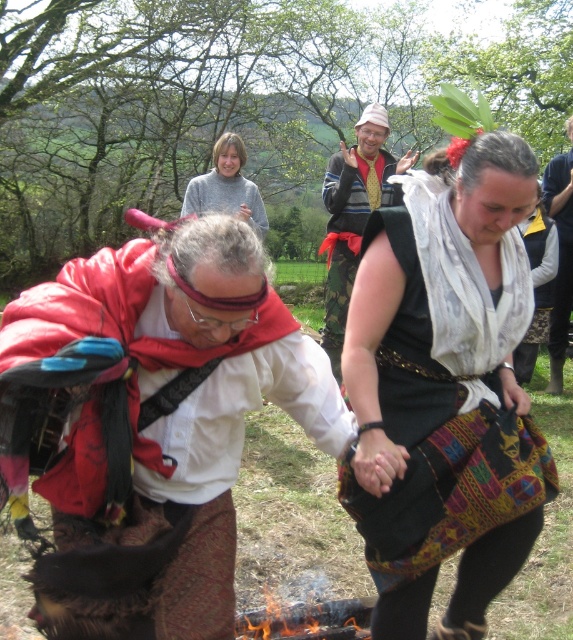
Question: Does striped sweater at center appear over velvet yellow vest at center?

Choices:
 (A) yes
 (B) no

Answer: (B)

Question: Which of the following is the farthest from the observer?

Choices:
 (A) velvet yellow vest at center
 (B) charcoal wood fire at lower center
 (C) light brown hair at upper center

Answer: (A)

Question: Is matte red cape at center wider than black woven fabric bag at center?

Choices:
 (A) yes
 (B) no

Answer: (A)

Question: Among these points, which one is farthest from the camera?

Choices:
 (A) coord(476,493)
 (B) coord(293,372)

Answer: (A)

Question: Among these objects, which one is nearest to the camera?

Choices:
 (A) light brown hair at upper center
 (B) striped sweater at center

Answer: (A)

Question: Does matte red cape at center appear over light brown hair at upper center?

Choices:
 (A) no
 (B) yes

Answer: (A)